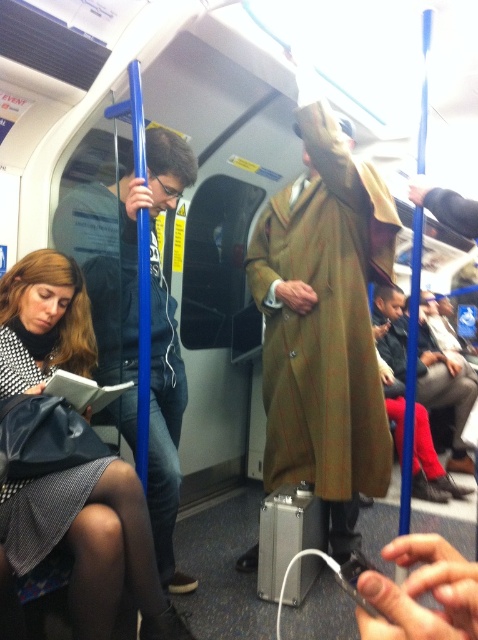
Question: Which object is farther from the camera taking this photo?

Choices:
 (A) green wool coat at center
 (B) matte black book at lower left

Answer: (A)

Question: Does matte black book at lower left appear on the left side of green wool coat at center?

Choices:
 (A) yes
 (B) no

Answer: (A)

Question: Which object appears farthest from the camera in this image?

Choices:
 (A) matte black book at lower left
 (B) brown woolen trench coat at center
 (C) green wool coat at center

Answer: (C)

Question: Which of the following is the farthest from the observer?

Choices:
 (A) (349, 250)
 (B) (425, 358)
 (C) (141, 492)

Answer: (B)

Question: Can you confirm if brown woolen trench coat at center is smaller than matte black book at lower left?

Choices:
 (A) yes
 (B) no

Answer: (B)

Question: Can you confirm if matte black book at lower left is positioned above green wool coat at center?

Choices:
 (A) no
 (B) yes

Answer: (A)